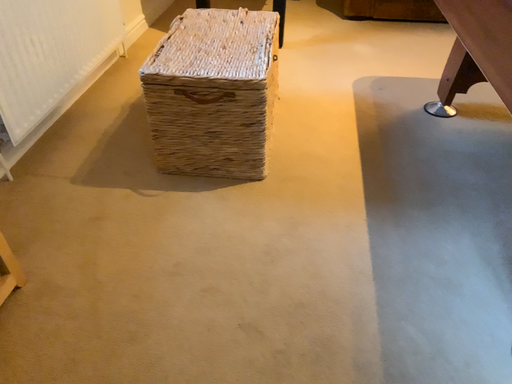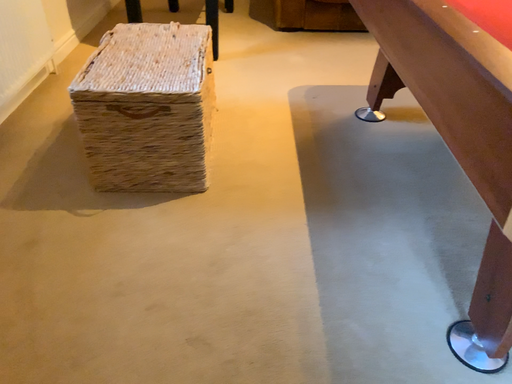
Question: How did the camera likely rotate when shooting the video?

Choices:
 (A) rotated right
 (B) rotated left

Answer: (A)